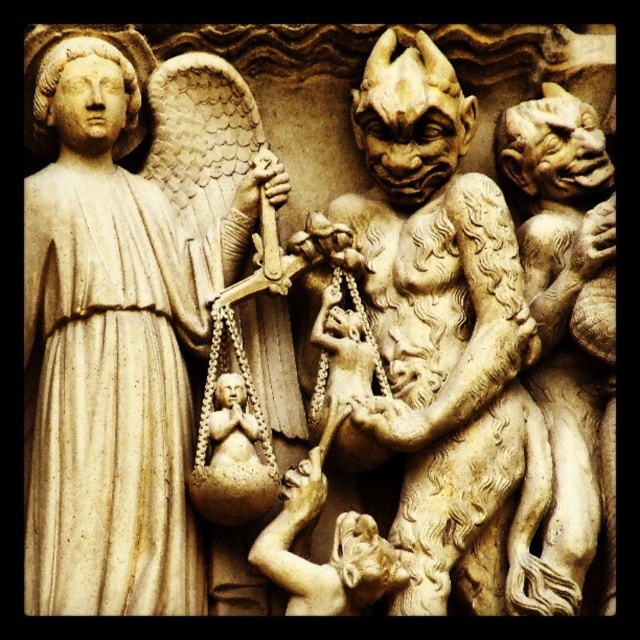
Question: Does matte stone angel at left lie behind beige stone gargoyle at right?

Choices:
 (A) no
 (B) yes

Answer: (A)

Question: Which object appears farthest from the camera in this image?

Choices:
 (A) beige stone gargoyle at right
 (B) matte stone angel at left

Answer: (A)

Question: Is matte stone angel at left to the left of beige stone gargoyle at right from the viewer's perspective?

Choices:
 (A) no
 (B) yes

Answer: (B)

Question: Which object is farther from the camera taking this photo?

Choices:
 (A) matte stone angel at left
 (B) beige stone gargoyle at right

Answer: (B)

Question: Which point is farther from the camera taking this photo?

Choices:
 (A) (115, 99)
 (B) (572, 595)

Answer: (A)

Question: Is matte stone angel at left closer to the viewer compared to beige stone gargoyle at right?

Choices:
 (A) no
 (B) yes

Answer: (B)